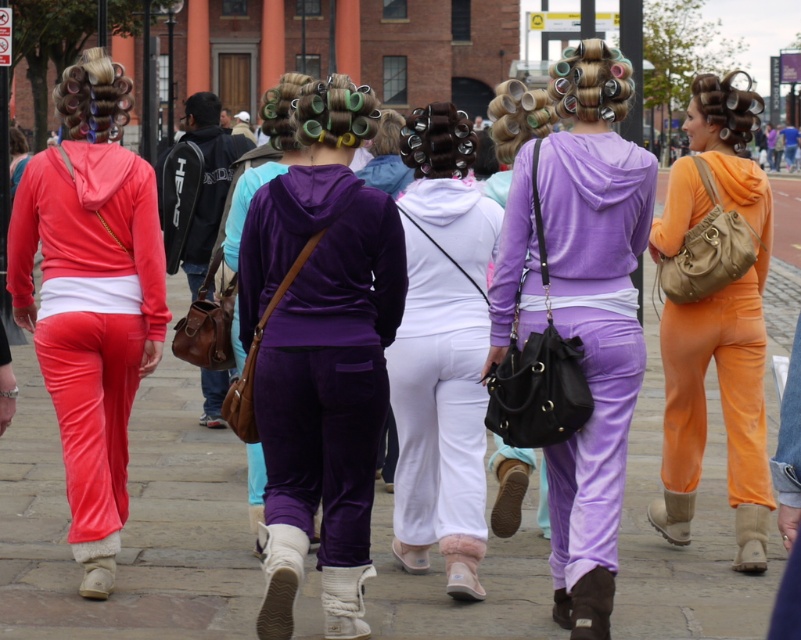
Question: Can you confirm if matte concrete pavement at center is positioned to the right of orange velour jumpsuit at center?

Choices:
 (A) no
 (B) yes

Answer: (A)

Question: Which of the following is the closest to the observer?

Choices:
 (A) (646, 440)
 (B) (284, 81)
 (C) (494, 468)

Answer: (C)

Question: Can you confirm if orange velour jumpsuit at center is wider than purple velvet hoodie at center?

Choices:
 (A) yes
 (B) no

Answer: (A)

Question: Which object is the closest to the velvet purple hoodie at center?

Choices:
 (A) white matte pants at center
 (B) matte velour pants at left

Answer: (A)

Question: Which point appears closest to the camera in this image?

Choices:
 (A) (504, 493)
 (B) (246, 177)
 (C) (256, 365)
 (D) (168, 429)

Answer: (C)

Question: Does velvet purple hoodie at center have a lesser width compared to purple velvet hoodie at center?

Choices:
 (A) yes
 (B) no

Answer: (A)